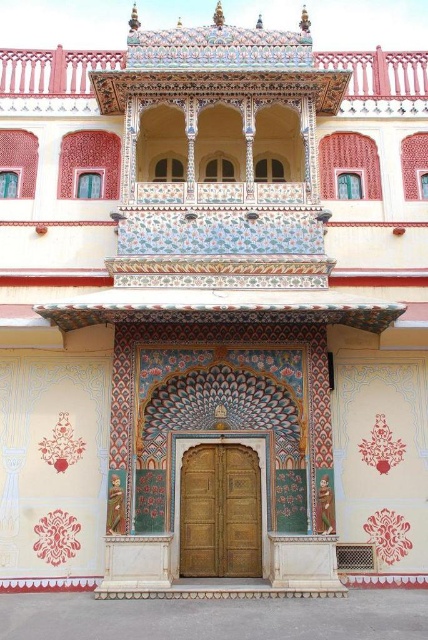
You are standing in front of the ornate doorway and want to take a photo. There are two points marked in the scene, point 1 at coordinates point (61, 113) and point 2 at coordinates point (237, 492). Which point is closer to your camera?

Point (61, 113) is closer to the camera than point (237, 492) because it is further to the camera than the other point.

You are standing in front of the ornate architectural structure described. There is a polychrome painted balcony at upper center that you want to reach. Considering your height is 1.7 meters, can you touch the balcony without any assistance?

The polychrome painted balcony at upper center is 52.70 meters away from the viewer. Since this distance is far greater than your height of 1.7 meters, you cannot touch it without assistance.

You are an architect examining the ornate building. The polychrome painted balcony at upper center is part of the structure. Where exactly is this balcony positioned relative to the main doorway?

The polychrome painted balcony at upper center is located at point (51, 77), which places it above and slightly to the right of the main doorway.